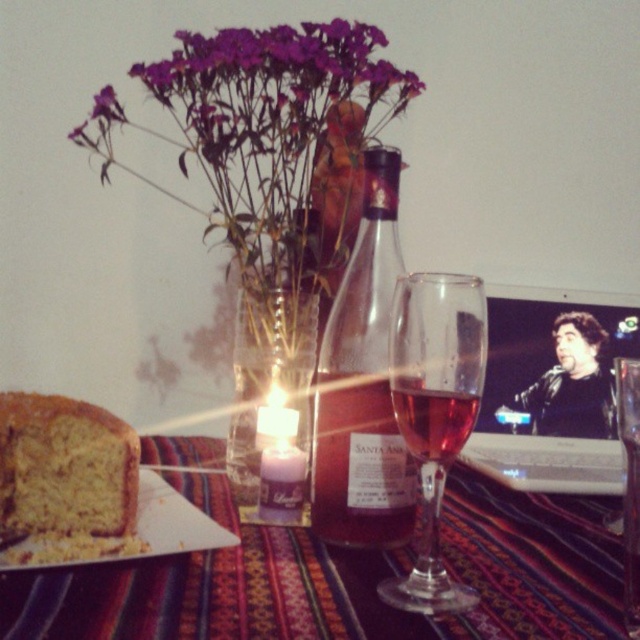
Based on the photo, who is positioned more to the right, matte glass bottle at center or golden crumbly bread at lower left?

Positioned to the right is matte glass bottle at center.

Is matte glass bottle at center taller than golden crumbly bread at lower left?

Yes.

What do you see at coordinates (360, 470) in the screenshot? This screenshot has width=640, height=640. I see `matte glass bottle at center` at bounding box center [360, 470].

Locate an element on the screen. This screenshot has width=640, height=640. matte glass bottle at center is located at coordinates (360, 470).

Locate an element on the screen. The width and height of the screenshot is (640, 640). textured fabric tablecloth at center is located at coordinates (344, 579).

Which is in front, point (276, 566) or point (44, 497)?

Point (44, 497) is in front.

Who is more forward, (x=12, y=573) or (x=90, y=499)?

Positioned in front is point (x=12, y=573).

I want to click on textured fabric tablecloth at center, so click(344, 579).

What do you see at coordinates (360, 470) in the screenshot?
I see `matte glass bottle at center` at bounding box center [360, 470].

Can you confirm if matte glass bottle at center is bigger than translucent glass santa ana wine at center?

Correct, matte glass bottle at center is larger in size than translucent glass santa ana wine at center.

This screenshot has width=640, height=640. Describe the element at coordinates (360, 470) in the screenshot. I see `matte glass bottle at center` at that location.

At what (x,y) coordinates should I click in order to perform the action: click on matte glass bottle at center. Please return your answer as a coordinate pair (x, y). This screenshot has height=640, width=640. Looking at the image, I should click on (360, 470).